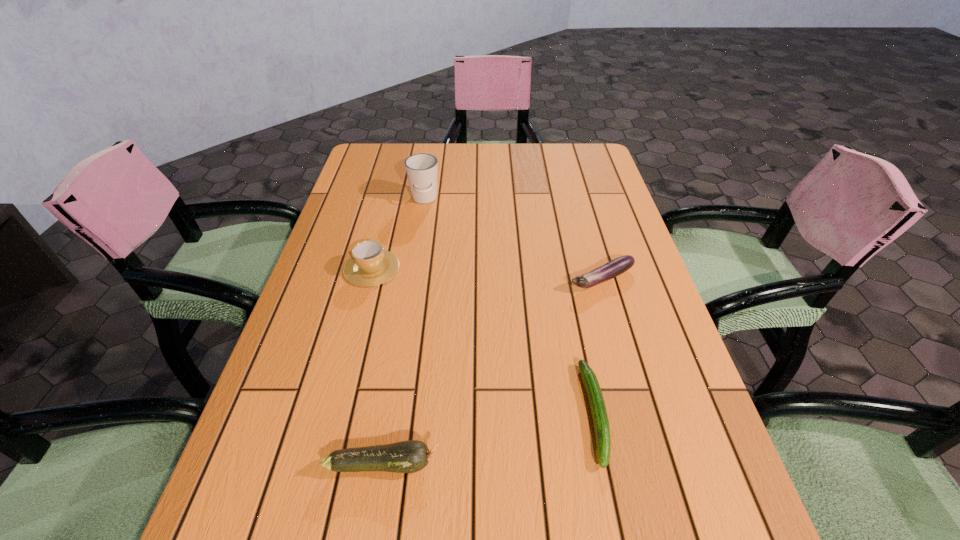
This screenshot has width=960, height=540. In order to click on the taller cup in this screenshot , I will do `click(421, 168)`.

Find the location of a particular element. The width and height of the screenshot is (960, 540). the farther cup is located at coordinates (421, 168).

I want to click on the shorter cup, so click(370, 265).

The image size is (960, 540). What are the coordinates of `the nearer cup` in the screenshot? It's located at (370, 265).

At what (x,y) coordinates should I click in order to perform the action: click on the left zucchini. Please return your answer as a coordinate pair (x, y). Image resolution: width=960 pixels, height=540 pixels. Looking at the image, I should click on (410, 456).

Find the location of a particular element. the second shortest object is located at coordinates (617, 266).

Where is `the shortest object`? This screenshot has height=540, width=960. the shortest object is located at coordinates (596, 401).

Where is `the shorter zucchini`? The height and width of the screenshot is (540, 960). the shorter zucchini is located at coordinates (596, 401).

The height and width of the screenshot is (540, 960). I want to click on free point located with a handle on the side of the farther cup, so click(x=408, y=301).

You are a GUI agent. You are given a task and a screenshot of the screen. Output one action in this format:
    pyautogui.click(x=<x>, y=<y>)
    Task: Click on the vacant space positioned with the handle on the side of the shorter cup
    This screenshot has height=540, width=960.
    Given the screenshot: What is the action you would take?
    pyautogui.click(x=395, y=180)